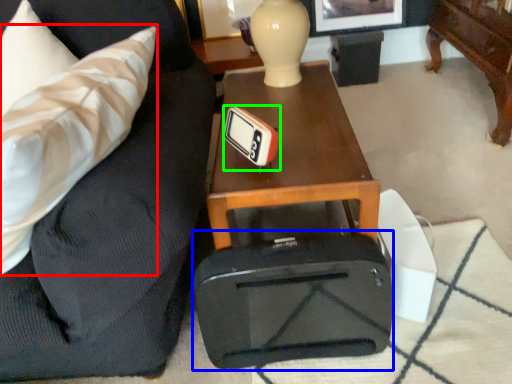
Question: Estimate the real-world distances between objects in this image. Which object is closer to throw pillow (highlighted by a red box), luggage (highlighted by a blue box) or thermometer (highlighted by a green box)?

Choices:
 (A) luggage
 (B) thermometer

Answer: (B)